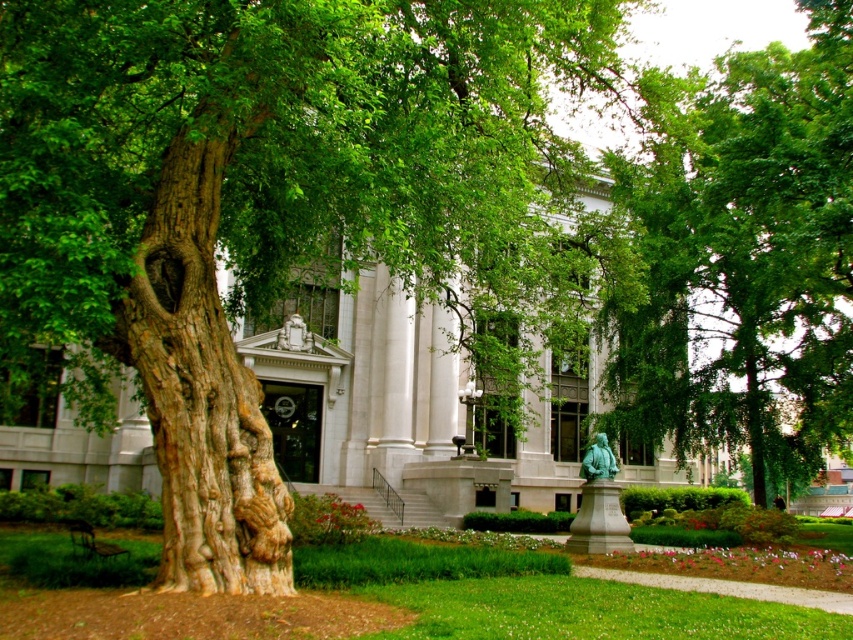
Does point (628, 288) come closer to viewer compared to point (296, 317)?

Yes.

Identify the location of green leafy tree at center. The height and width of the screenshot is (640, 853). (741, 257).

Who is positioned more to the left, green leafy tree at center or green patina statue at center?

Positioned to the left is green patina statue at center.

Can you confirm if green leafy tree at center is smaller than green patina statue at center?

Incorrect, green leafy tree at center is not smaller in size than green patina statue at center.

Who is more forward, (x=782, y=250) or (x=589, y=449)?

Point (x=589, y=449) is in front.

This screenshot has width=853, height=640. I want to click on green leafy tree at center, so (741, 257).

Between green patina statue at center and green marble statue at center, which one is positioned lower?

Positioned lower is green patina statue at center.

Who is shorter, green patina statue at center or green marble statue at center?

green patina statue at center is shorter.

Who is more forward, (587,452) or (285,344)?

Point (587,452) is in front.

Locate an element on the screen. green patina statue at center is located at coordinates (598, 460).